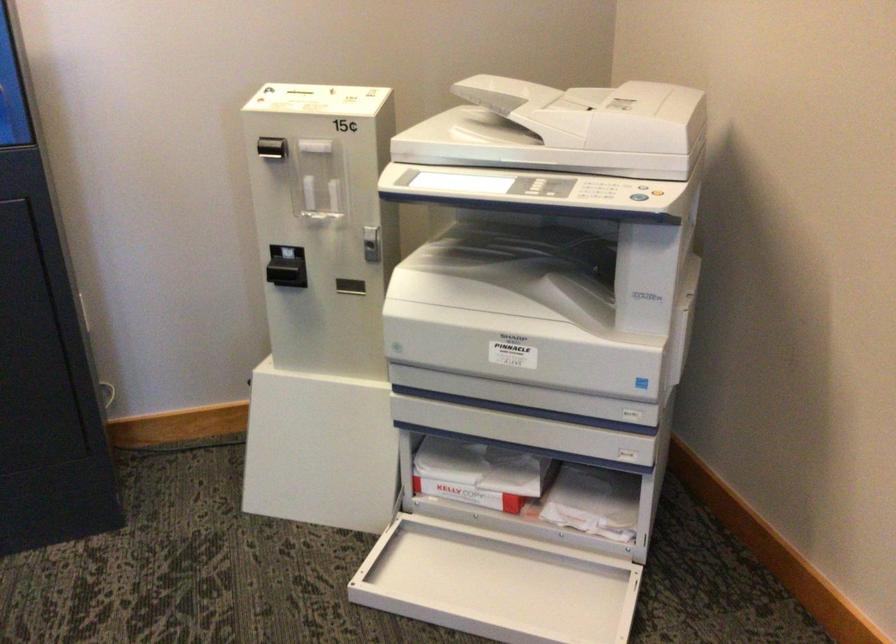
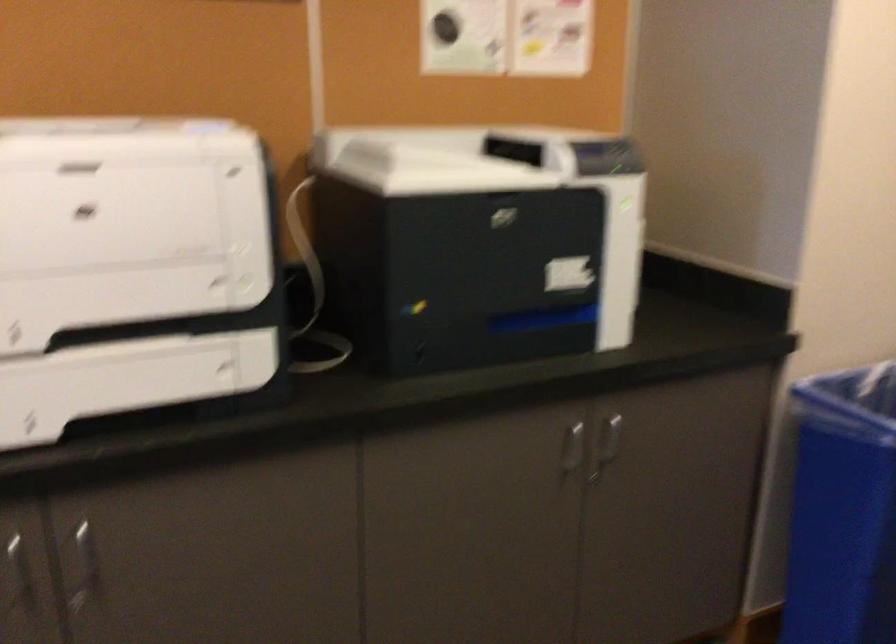
Question: The images are taken continuously from a first-person perspective. In which direction is your viewpoint rotating?

Choices:
 (A) Left
 (B) Right
 (C) Up
 (D) Down

Answer: (A)